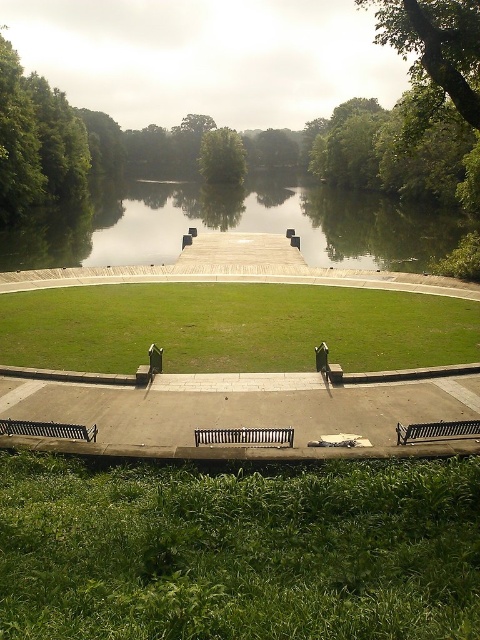
Is green grassy field at center shorter than black metal bench at lower left?

In fact, green grassy field at center may be taller than black metal bench at lower left.

Between point (205, 364) and point (57, 429), which one is positioned in front?

Point (57, 429)

Image resolution: width=480 pixels, height=640 pixels. I want to click on green grassy field at center, so click(x=233, y=326).

Image resolution: width=480 pixels, height=640 pixels. What do you see at coordinates (237, 225) in the screenshot?
I see `green reflective water at center` at bounding box center [237, 225].

Who is shorter, green reflective water at center or metallic silver bench at lower right?

metallic silver bench at lower right

Does point (235, 205) come farther from viewer compared to point (437, 436)?

That is True.

Locate an element on the screen. The height and width of the screenshot is (640, 480). green reflective water at center is located at coordinates (237, 225).

Which is more to the left, green grassy at lower center or metallic silver bench at lower right?

green grassy at lower center

Looking at this image, can you confirm if green grassy at lower center is wider than metallic silver bench at lower right?

Yes.

Where is `green grassy at lower center`? green grassy at lower center is located at coordinates (239, 550).